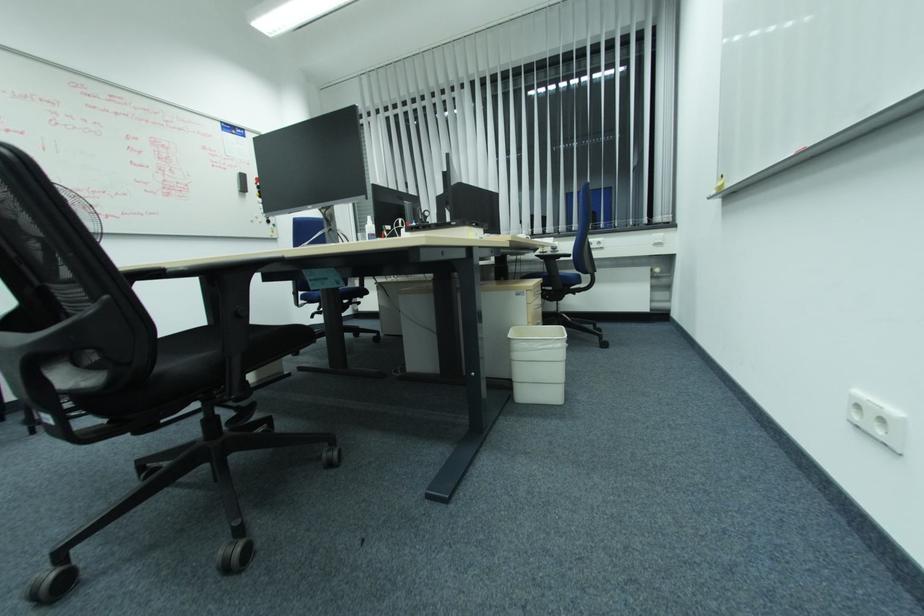
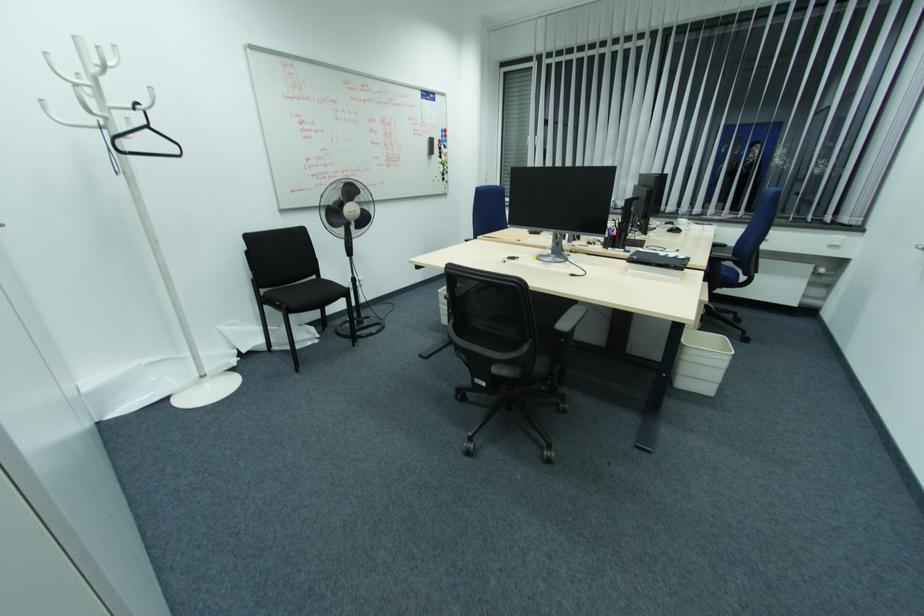
Where in the second image is the point corresponding to (526,345) from the first image?

(698, 353)